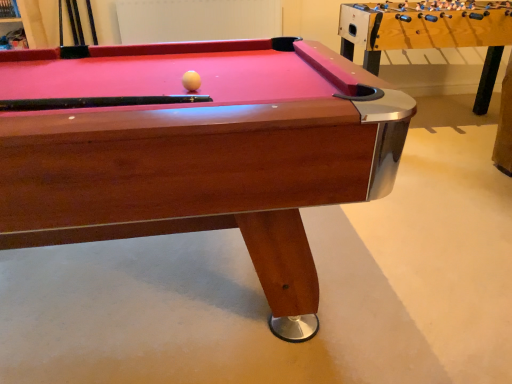
The width and height of the screenshot is (512, 384). I want to click on white matte ball at center, so click(191, 81).

Identify the location of wooden billiard table at center. The height and width of the screenshot is (384, 512). (198, 152).

Considering the sizes of objects wooden foosball table at right and wooden billiard table at center in the image provided, who is shorter, wooden foosball table at right or wooden billiard table at center?

wooden billiard table at center is shorter.

Considering the positions of objects wooden foosball table at right and wooden billiard table at center in the image provided, who is more to the left, wooden foosball table at right or wooden billiard table at center?

Positioned to the left is wooden billiard table at center.

Are wooden foosball table at right and wooden billiard table at center far apart?

That's right, there is a large distance between wooden foosball table at right and wooden billiard table at center.

Consider the image. Is wooden foosball table at right inside the boundaries of wooden billiard table at center, or outside?

wooden foosball table at right is outside wooden billiard table at center.

What's the angular difference between white matte ball at center and wooden billiard table at center's facing directions?

The angular difference between white matte ball at center and wooden billiard table at center is 13.5 degrees.

From the picture: Is white matte ball at center oriented towards wooden billiard table at center?

Yes.

Is white matte ball at center inside the boundaries of wooden billiard table at center, or outside?

white matte ball at center exists entirely within wooden billiard table at center.

From a real-world perspective, is white matte ball at center over wooden billiard table at center?

Yes, from a real-world perspective, white matte ball at center is above wooden billiard table at center.

From the image's perspective, which is below, white matte ball at center or wooden foosball table at right?

white matte ball at center appears lower in the image.

Which object is positioned more to the right, white matte ball at center or wooden foosball table at right?

wooden foosball table at right.

From their relative heights in the image, would you say white matte ball at center is taller or shorter than wooden foosball table at right?

In the image, white matte ball at center appears to be shorter than wooden foosball table at right.

Which is more to the right, wooden billiard table at center or white matte ball at center?

From the viewer's perspective, white matte ball at center appears more on the right side.

Is wooden billiard table at center looking in the opposite direction of white matte ball at center?

No.

How different are the orientations of wooden billiard table at center and white matte ball at center in degrees?

wooden billiard table at center and white matte ball at center are facing 13.5 degrees away from each other.

Is wooden billiard table at center outside of white matte ball at center?

Indeed, wooden billiard table at center is completely outside white matte ball at center.

Which is less distant, (118, 66) or (481, 14)?

The point (118, 66) is in front.

Is wooden billiard table at center aimed at wooden foosball table at right?

No, wooden billiard table at center does not turn towards wooden foosball table at right.

From a real-world perspective, which object stands above the other?

From a 3D spatial view, wooden foosball table at right is above.

How many degrees apart are the facing directions of wooden billiard table at center and wooden foosball table at right?

They differ by 2.32 degrees in their facing directions.

Is wooden foosball table at right thinner than white matte ball at center?

Incorrect, the width of wooden foosball table at right is not less than that of white matte ball at center.

Is wooden foosball table at right taller than white matte ball at center?

Correct, wooden foosball table at right is much taller as white matte ball at center.

Is wooden foosball table at right with white matte ball at center?

No, wooden foosball table at right is not making contact with white matte ball at center.

At what (x,y) coordinates should I click in order to perform the action: click on table above the wooden billiard table at center (from a real-world perspective). Please return your answer as a coordinate pair (x, y). Looking at the image, I should click on (429, 33).

Identify the location of billiard table in front of the white matte ball at center. (198, 152).

Which object lies nearer to the anchor point wooden billiard table at center, wooden foosball table at right or white matte ball at center?

The object closer to wooden billiard table at center is white matte ball at center.

Which object lies further to the anchor point wooden foosball table at right, white matte ball at center or wooden billiard table at center?

Among the two, white matte ball at center is located further to wooden foosball table at right.

Looking at the image, which one is located closer to white matte ball at center, wooden foosball table at right or wooden billiard table at center?

wooden billiard table at center lies closer to white matte ball at center than the other object.

Based on their spatial positions, is white matte ball at center or wooden foosball table at right closer to wooden billiard table at center?

white matte ball at center is positioned closer to the anchor wooden billiard table at center.

In the scene shown: Considering their positions, is wooden billiard table at center positioned further to wooden foosball table at right than white matte ball at center?

Among the two, white matte ball at center is located further to wooden foosball table at right.

Which object lies nearer to the anchor point white matte ball at center, wooden billiard table at center or wooden foosball table at right?

The object closer to white matte ball at center is wooden billiard table at center.

The width and height of the screenshot is (512, 384). I want to click on ball between wooden billiard table at center and wooden foosball table at right from left to right, so click(x=191, y=81).